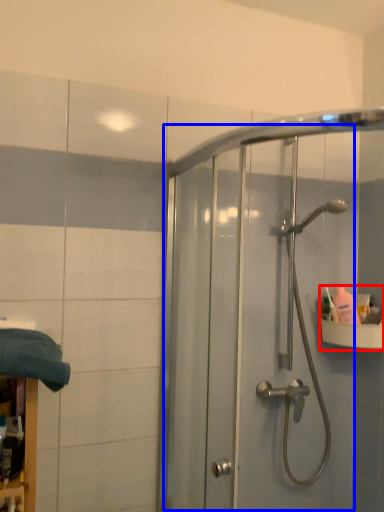
Question: Among these objects, which one is farthest to the camera, sink (highlighted by a red box) or screen door (highlighted by a blue box)?

Choices:
 (A) sink
 (B) screen door

Answer: (A)